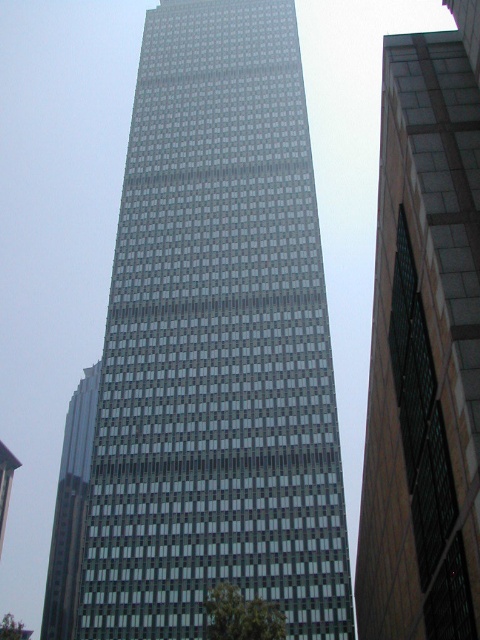
Question: Which point appears farthest from the camera in this image?

Choices:
 (A) tap(74, 416)
 (B) tap(459, 193)

Answer: (A)

Question: Is glassy reflective skyscraper at center bigger than glassy reflective skyscraper at left?

Choices:
 (A) no
 (B) yes

Answer: (A)

Question: Which of these objects is positioned closest to the glassy reflective skyscraper at center?

Choices:
 (A) glassy reflective skyscraper at left
 (B) glassy steel tower at center

Answer: (B)

Question: Can you confirm if glassy steel tower at center is bigger than glassy reflective skyscraper at center?

Choices:
 (A) yes
 (B) no

Answer: (A)

Question: Which point appears farthest from the camera in this image?

Choices:
 (A) (468, 32)
 (B) (286, 20)
 (C) (79, 493)

Answer: (C)

Question: Is glassy steel tower at center thinner than glassy reflective skyscraper at left?

Choices:
 (A) yes
 (B) no

Answer: (A)